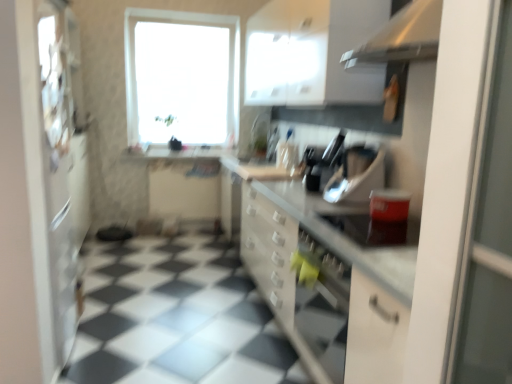
Question: From the image's perspective, is white matte refrigerator at left positioned above or below transparent glass window at upper center?

Choices:
 (A) below
 (B) above

Answer: (A)

Question: Is white matte refrigerator at left taller or shorter than transparent glass window at upper center?

Choices:
 (A) short
 (B) tall

Answer: (B)

Question: Which object is the closest to the transparent glass window at upper center?

Choices:
 (A) white glossy countertop at center
 (B) white glossy cabinet at upper center
 (C) white matte refrigerator at left
 (D) matte black toaster at center, the third appliance viewed from the back
 (E) metallic silver toaster at center, placed as the 2th appliance when sorted from front to back

Answer: (B)

Question: Estimate the real-world distances between objects in this image. Which object is farther from the metallic silver toaster at center, placed as the 2th appliance when sorted from front to back?

Choices:
 (A) white glossy countertop at center
 (B) black plastic knife block at center, which is the first appliance from back to front
 (C) matte black toaster at center, the third appliance viewed from the back
 (D) transparent glass window at upper center
 (E) white glossy cabinet at upper center

Answer: (D)